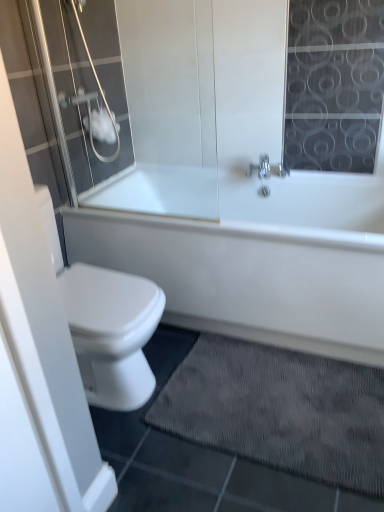
Where is `free spot above dark gray textured bath mat at lower center (from a real-world perspective)`? The width and height of the screenshot is (384, 512). free spot above dark gray textured bath mat at lower center (from a real-world perspective) is located at coordinates (273, 398).